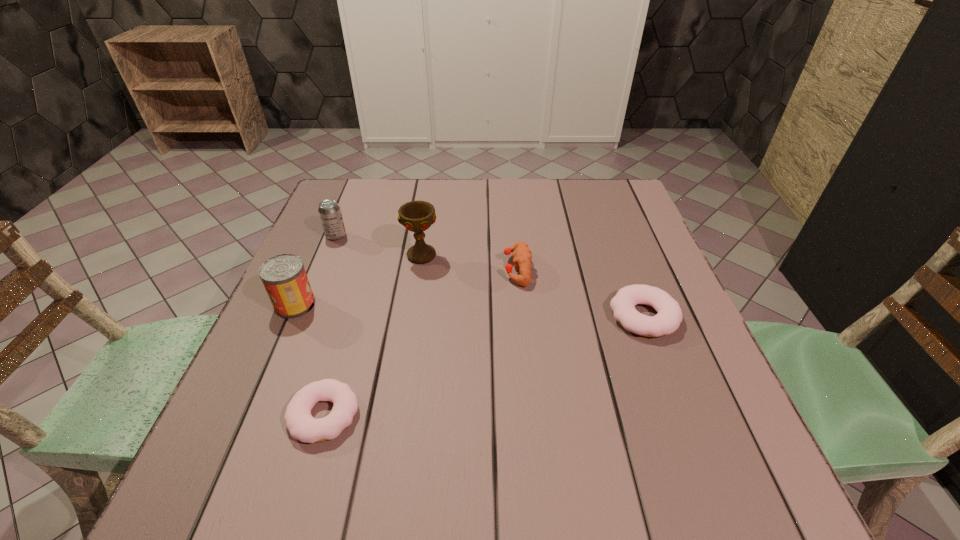
Locate an element on the screen. unoccupied area between the third object from right to left and the nearest object is located at coordinates (372, 335).

The image size is (960, 540). What are the coordinates of `free space that is in between the second object from right to left and the right doughnut` in the screenshot? It's located at (581, 292).

This screenshot has width=960, height=540. In order to click on free spot between the beer can and the can in this screenshot , I will do `click(316, 270)`.

Where is `free space between the shorter doughnut and the can`? The height and width of the screenshot is (540, 960). free space between the shorter doughnut and the can is located at coordinates (310, 360).

Find the location of a particular element. Image resolution: width=960 pixels, height=540 pixels. free space that is in between the third object from left to right and the can is located at coordinates (310, 360).

The image size is (960, 540). In order to click on empty location between the third object from right to left and the farther doughnut in this screenshot , I will do `click(533, 286)`.

Find the location of a particular element. This screenshot has width=960, height=540. free area in between the puncher and the farther doughnut is located at coordinates (581, 292).

I want to click on vacant area that lies between the fifth tallest object and the farthest object, so click(x=490, y=276).

You are a GUI agent. You are given a task and a screenshot of the screen. Output one action in this format:
    pyautogui.click(x=<x>, y=<y>)
    Task: Click on the second closest object to the fifth tallest object
    Image resolution: width=960 pixels, height=540 pixels.
    Given the screenshot: What is the action you would take?
    pyautogui.click(x=417, y=216)

The image size is (960, 540). What are the coordinates of `object that is the third nearest to the nearer doughnut` in the screenshot? It's located at (522, 255).